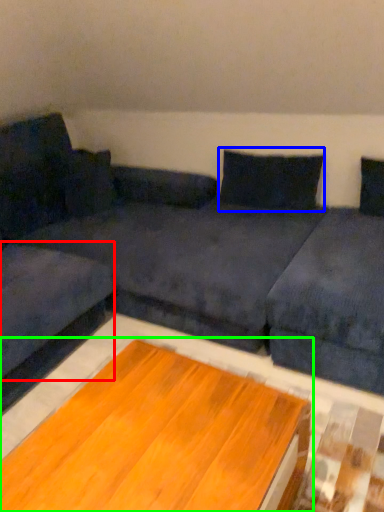
Question: Which object is the closest to the couch (highlighted by a red box)? Choose among these: pillow (highlighted by a blue box) or table (highlighted by a green box).

Choices:
 (A) pillow
 (B) table

Answer: (B)